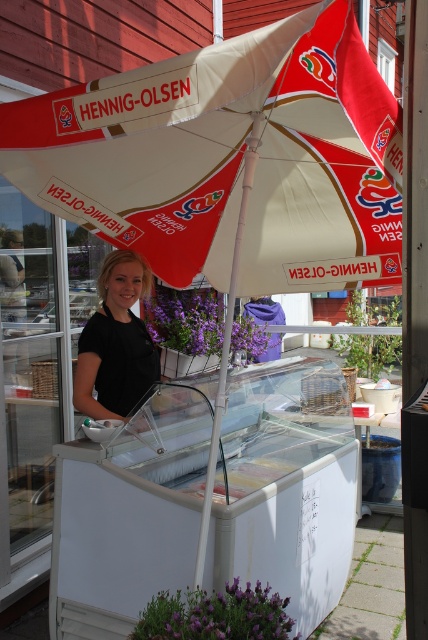
Question: Does white fabric umbrella at center appear on the left side of black matte shirt at center?

Choices:
 (A) yes
 (B) no

Answer: (B)

Question: Which of the following is the closest to the observer?

Choices:
 (A) black matte shirt at center
 (B) white fabric umbrella at center

Answer: (B)

Question: Can you confirm if white fabric umbrella at center is thinner than black matte shirt at center?

Choices:
 (A) yes
 (B) no

Answer: (B)

Question: Which of the following is the closest to the observer?

Choices:
 (A) (118, 314)
 (B) (217, 51)

Answer: (B)

Question: Does white fabric umbrella at center appear under black matte shirt at center?

Choices:
 (A) no
 (B) yes

Answer: (A)